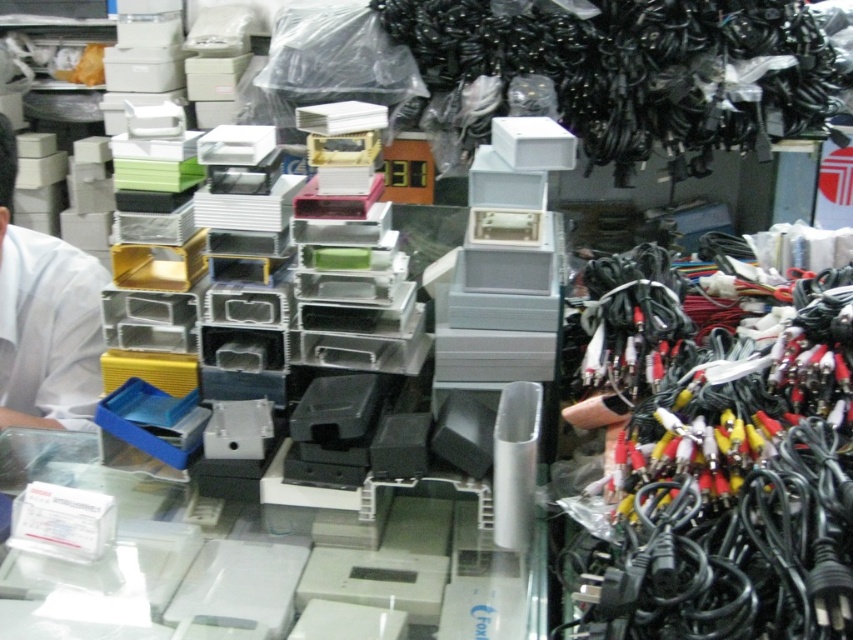
Question: Estimate the real-world distances between objects in this image. Which object is closer to the black rubber cables at upper right?

Choices:
 (A) black rubber cables at right
 (B) white matte shirt at left

Answer: (A)

Question: Is black rubber cables at upper right thinner than white matte shirt at left?

Choices:
 (A) yes
 (B) no

Answer: (B)

Question: Among these objects, which one is nearest to the camera?

Choices:
 (A) black rubber cables at upper right
 (B) white matte shirt at left
 (C) black rubber cables at right

Answer: (C)

Question: Can you confirm if black rubber cables at upper right is smaller than white matte shirt at left?

Choices:
 (A) yes
 (B) no

Answer: (B)

Question: Among these points, which one is nearest to the camera?

Choices:
 (A) (53, 323)
 (B) (718, 419)

Answer: (B)

Question: Is the position of black rubber cables at right more distant than that of black rubber cables at upper right?

Choices:
 (A) no
 (B) yes

Answer: (A)